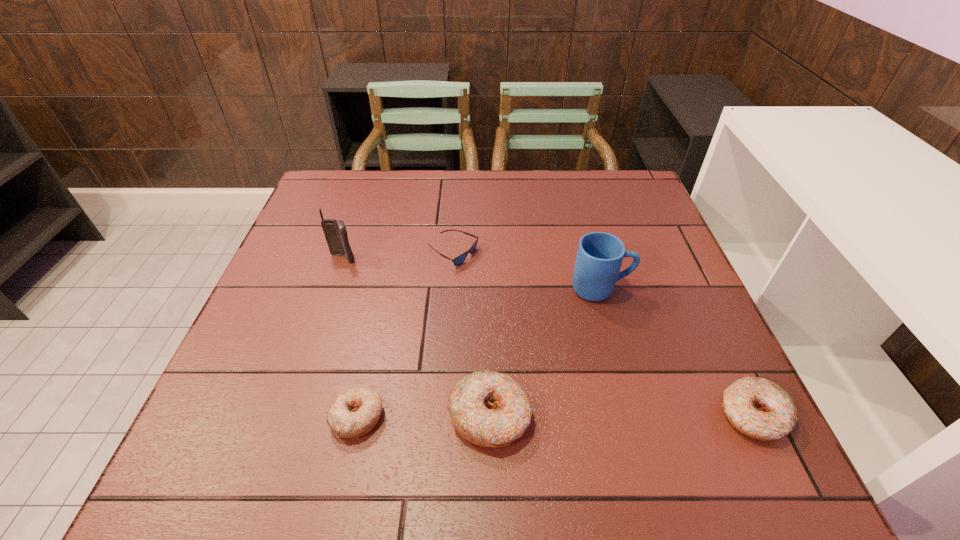
Identify the location of free space between the mug and the rightmost object. (677, 352).

The image size is (960, 540). What are the coordinates of `free space between the leftmost object and the rightmost doughnut` in the screenshot? It's located at (548, 336).

At what (x,y) coordinates should I click in order to perform the action: click on vacant region between the third tallest object and the mug. Please return your answer as a coordinate pair (x, y). This screenshot has height=540, width=960. Looking at the image, I should click on (545, 353).

Locate an element on the screen. The image size is (960, 540). free area in between the leftmost object and the third tallest object is located at coordinates (417, 338).

Find the location of a particular element. This screenshot has width=960, height=540. free area in between the second doughnut from right to left and the fourth nearest object is located at coordinates (545, 353).

Where is `unoccupied position between the rightmost object and the tallest doughnut`? This screenshot has width=960, height=540. unoccupied position between the rightmost object and the tallest doughnut is located at coordinates (621, 415).

Identify which object is the closest to the cellular telephone. Please provide its 2D coordinates. Your answer should be formatted as a tuple, i.e. [(x, y)], where the tuple contains the x and y coordinates of a point satisfying the conditions above.

[(460, 259)]

In order to click on object that is the closest one to the shortest object in this screenshot , I will do `click(335, 232)`.

Find the location of a particular element. Image resolution: width=960 pixels, height=540 pixels. doughnut that stands as the closest to the second shortest object is located at coordinates (488, 408).

Locate which doughnut is the third closest to the fifth object from left to right. Please provide its 2D coordinates. Your answer should be formatted as a tuple, i.e. [(x, y)], where the tuple contains the x and y coordinates of a point satisfying the conditions above.

[(353, 413)]